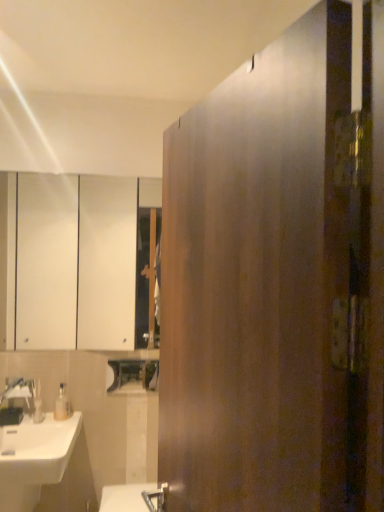
Find the location of a particular element. free space in front of translucent plastic soap dispenser at lower left is located at coordinates (59, 426).